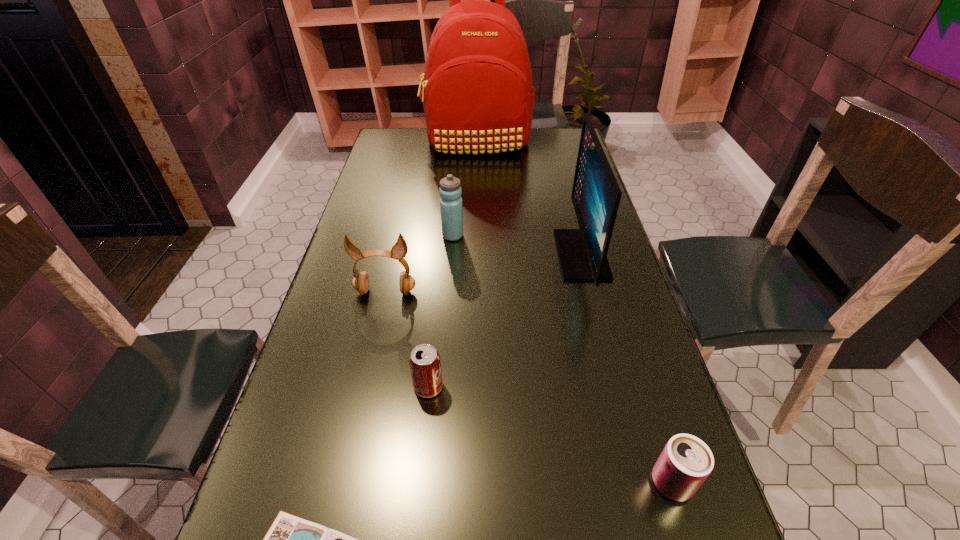
Locate an element on the screen. The image size is (960, 540). free space located on the screen side of the second tallest object is located at coordinates (462, 255).

What are the coordinates of `free spot located on the front of the water bottle` in the screenshot? It's located at (448, 294).

This screenshot has width=960, height=540. What are the coordinates of `vacant point located 0.190m on the front-facing side of the earphone` in the screenshot? It's located at (371, 360).

What are the coordinates of `vacant space situated on the back of the soda can` in the screenshot? It's located at (438, 295).

The width and height of the screenshot is (960, 540). In order to click on free space located on the left of the second nearest object in this screenshot , I will do `click(439, 483)`.

I want to click on object that is at the far edge, so click(477, 94).

Where is `object present at the left edge`? Image resolution: width=960 pixels, height=540 pixels. object present at the left edge is located at coordinates (360, 282).

Image resolution: width=960 pixels, height=540 pixels. Identify the location of monitor present at the right edge. (596, 195).

The width and height of the screenshot is (960, 540). In order to click on can situated at the right edge in this screenshot , I will do `click(686, 461)`.

At what (x,y) coordinates should I click in order to perform the action: click on free location at the left edge. Please return your answer as a coordinate pair (x, y). Image resolution: width=960 pixels, height=540 pixels. Looking at the image, I should click on (330, 367).